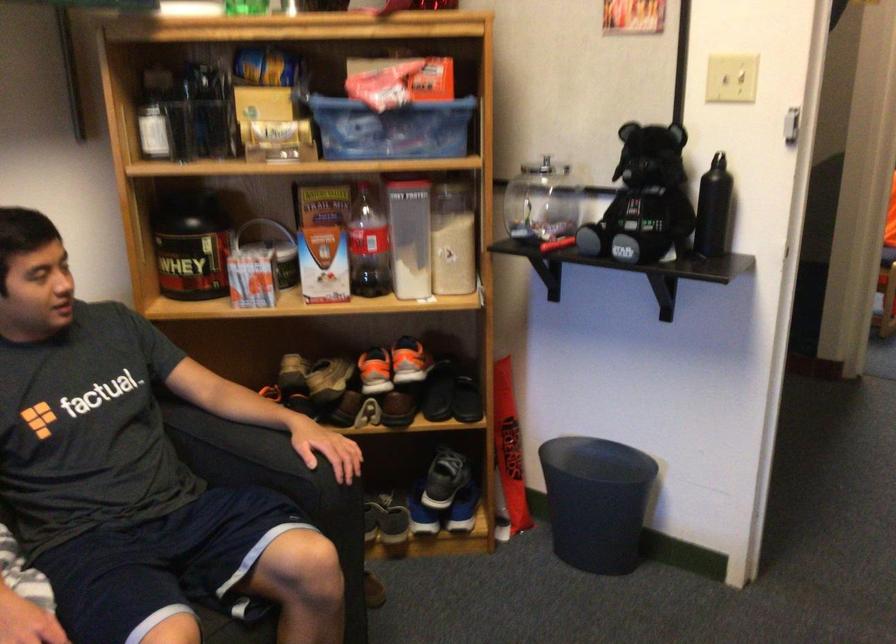
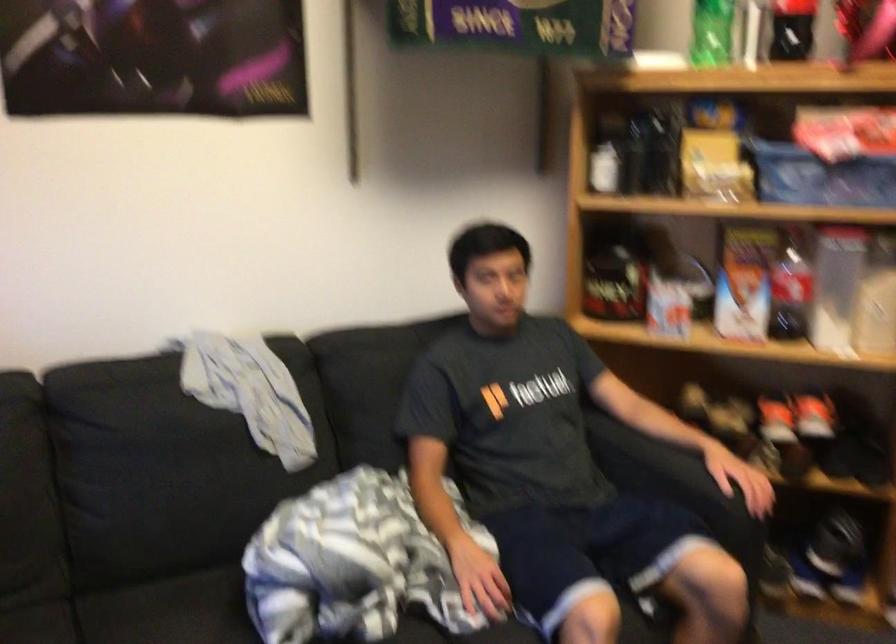
In the second image, find the point that corresponds to (378,129) in the first image.

(820, 176)